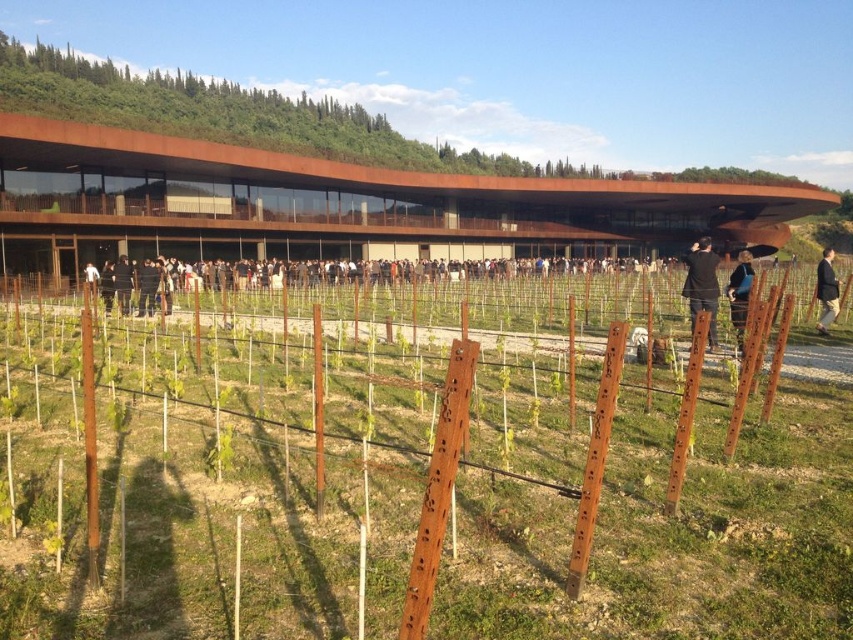
Consider the image. Is rustic wood building at upper center smaller than black fabric jacket at center?

No, rustic wood building at upper center is not smaller than black fabric jacket at center.

Between point (437, 145) and point (685, 289), which one is positioned in front?

Point (685, 289)

The height and width of the screenshot is (640, 853). Identify the location of rustic wood building at upper center. (233, 113).

Between black fabric at center and blue fabric at center, which one appears on the right side from the viewer's perspective?

blue fabric at center

Who is positioned more to the left, black fabric at center or blue fabric at center?

black fabric at center is more to the left.

Is point (614, 305) closer to viewer compared to point (732, 308)?

No, (614, 305) is further to viewer.

Where is `black fabric at center`? This screenshot has width=853, height=640. black fabric at center is located at coordinates (403, 288).

Is black fabric at center shorter than black fabric jacket at center?

Indeed, black fabric at center has a lesser height compared to black fabric jacket at center.

Can you confirm if black fabric at center is taller than black fabric jacket at center?

In fact, black fabric at center may be shorter than black fabric jacket at center.

In order to click on black fabric at center in this screenshot , I will do `click(403, 288)`.